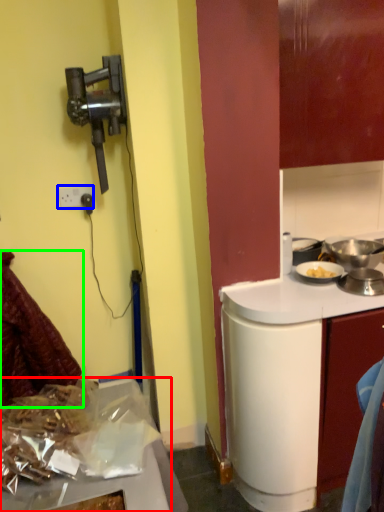
Question: Which object is the farthest from kitchen appliance (highlighted by a red box)? Choose among these: power outlet (highlighted by a blue box) or laundry (highlighted by a green box).

Choices:
 (A) power outlet
 (B) laundry

Answer: (A)